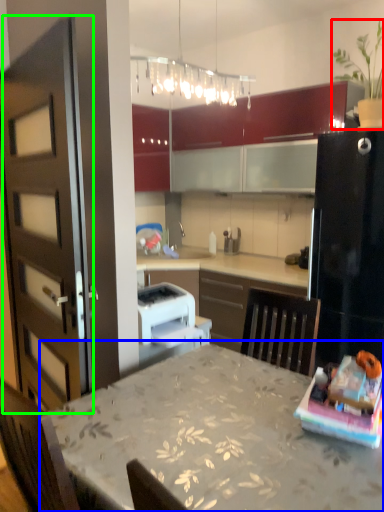
Question: Which object is positioned farthest from houseplant (highlighted by a red box)? Select from table (highlighted by a blue box) and door (highlighted by a green box).

Choices:
 (A) table
 (B) door

Answer: (A)